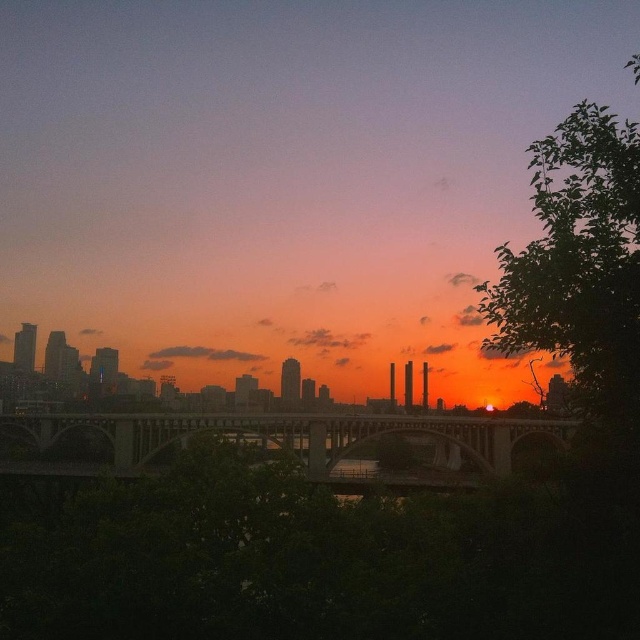
Question: Does green leafy tree at right have a greater width compared to concrete bridge at center?

Choices:
 (A) yes
 (B) no

Answer: (B)

Question: Considering the relative positions of green leafy tree at right and concrete bridge at center in the image provided, where is green leafy tree at right located with respect to concrete bridge at center?

Choices:
 (A) above
 (B) below

Answer: (A)

Question: Among these points, which one is farthest from the camera?

Choices:
 (A) (540, 256)
 (B) (404, 417)

Answer: (A)

Question: Does green leafy tree at right appear on the left side of concrete bridge at center?

Choices:
 (A) no
 (B) yes

Answer: (A)